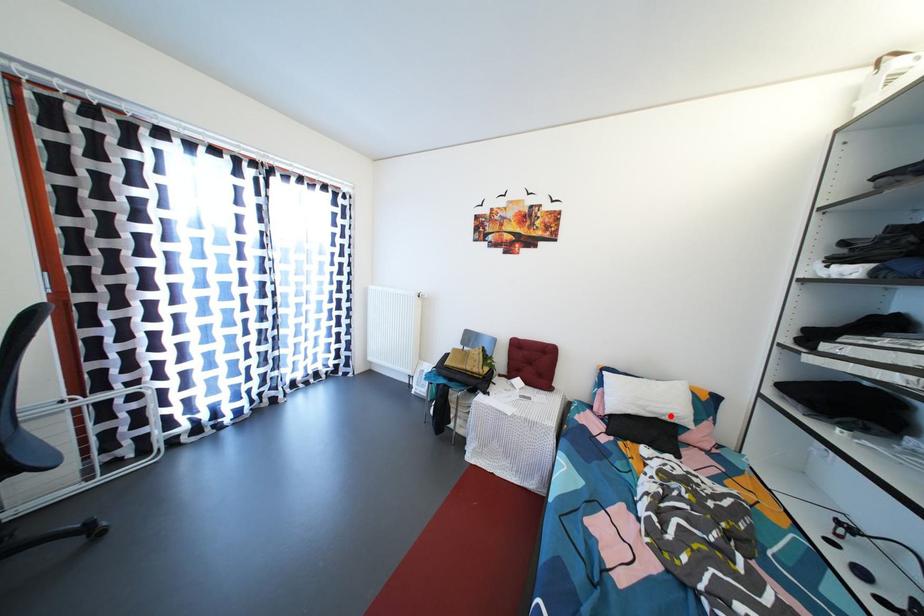
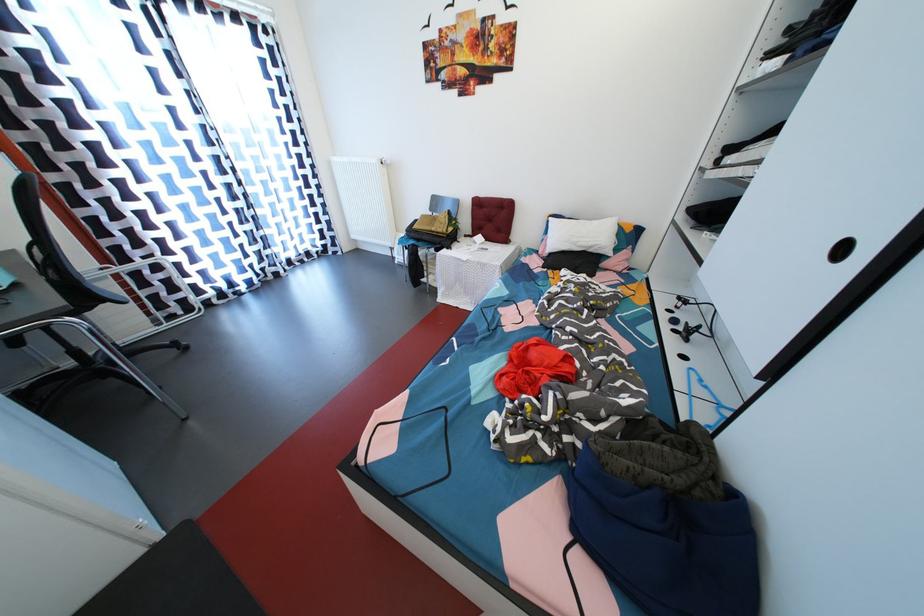
Locate, in the second image, the point that corresponds to the highlighted location in the first image.

(597, 249)